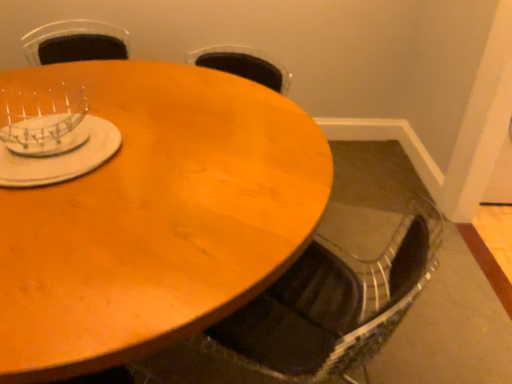
Question: Considering their positions, is wooden table at center located in front of or behind metallic silver swivel chair at lower center?

Choices:
 (A) behind
 (B) front

Answer: (B)

Question: Is point [157, 84] positioned closer to the camera than point [306, 266]?

Choices:
 (A) closer
 (B) farther

Answer: (B)

Question: Which is nearer to the metallic silver swivel chair at lower center?

Choices:
 (A) wooden table at center
 (B) white matte plate at upper left, which is the 2th tableware from top to bottom
 (C) clear plastic dish rack at upper left, which is the first tableware in top-to-bottom order

Answer: (A)

Question: Estimate the real-world distances between objects in this image. Which object is closer to the white matte plate at upper left, which is the 2th tableware from top to bottom?

Choices:
 (A) wooden table at center
 (B) clear plastic dish rack at upper left, placed as the 2th tableware when sorted from bottom to top
 (C) metallic silver swivel chair at lower center

Answer: (B)